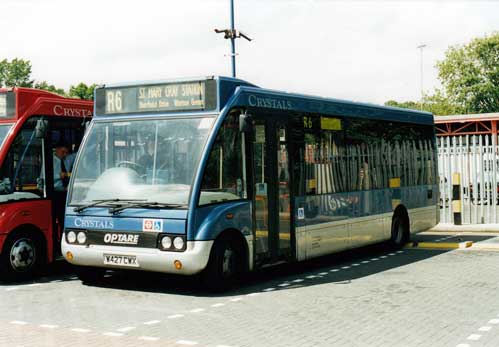
Locate an element on the screen. This screenshot has width=499, height=347. door is located at coordinates (290, 212).